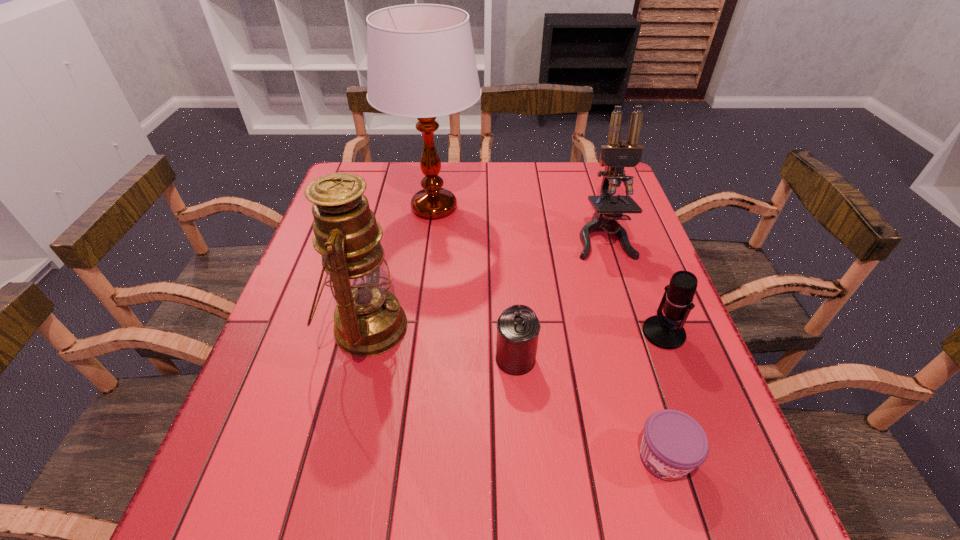
Image resolution: width=960 pixels, height=540 pixels. I want to click on the tallest object, so click(x=421, y=64).

This screenshot has height=540, width=960. I want to click on oil lamp, so click(x=369, y=320).

Where is `microscope`? The width and height of the screenshot is (960, 540). microscope is located at coordinates (616, 155).

At what (x,y) coordinates should I click in order to perform the action: click on the third shortest object. Please return your answer as a coordinate pair (x, y). This screenshot has width=960, height=540. Looking at the image, I should click on (665, 332).

Identify the location of can. (518, 327).

Locate an element on the screen. the third object from left to right is located at coordinates (518, 327).

Where is `jam`? This screenshot has width=960, height=540. jam is located at coordinates (673, 444).

Find the location of a particular element. This screenshot has width=960, height=540. the shortest object is located at coordinates (673, 444).

Locate an element on the screen. The image size is (960, 540). free space located 0.110m on the front of the tallest object is located at coordinates (427, 265).

I want to click on vacant space situated on the front of the oil lamp, so click(339, 447).